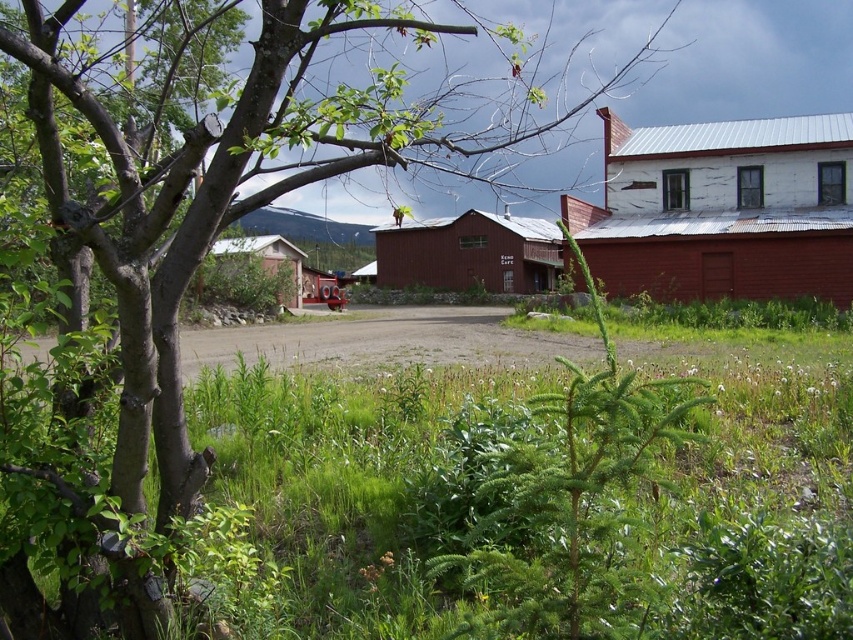
You are standing at the entrance of the rustic wood barn at center and want to walk to the rusty corrugated metal barn at right. Which direction should you head?

You should head to the right because the rusty corrugated metal barn at right is located to the right of the rustic wood barn at center.

What are the coordinates of the rusty corrugated metal barn at right?

The rusty corrugated metal barn at right is located at coordinates point (722, 209).

Based on the photo, you are a farmer who needs to move a large tractor from the rusty corrugated metal barn at right to the green leafy plant at center. Considering their sizes, will the tractor fit through the space between them?

The rusty corrugated metal barn at right is larger than the green leafy plant at center. Since the barn is bigger, there should be enough space for the tractor to pass between them.